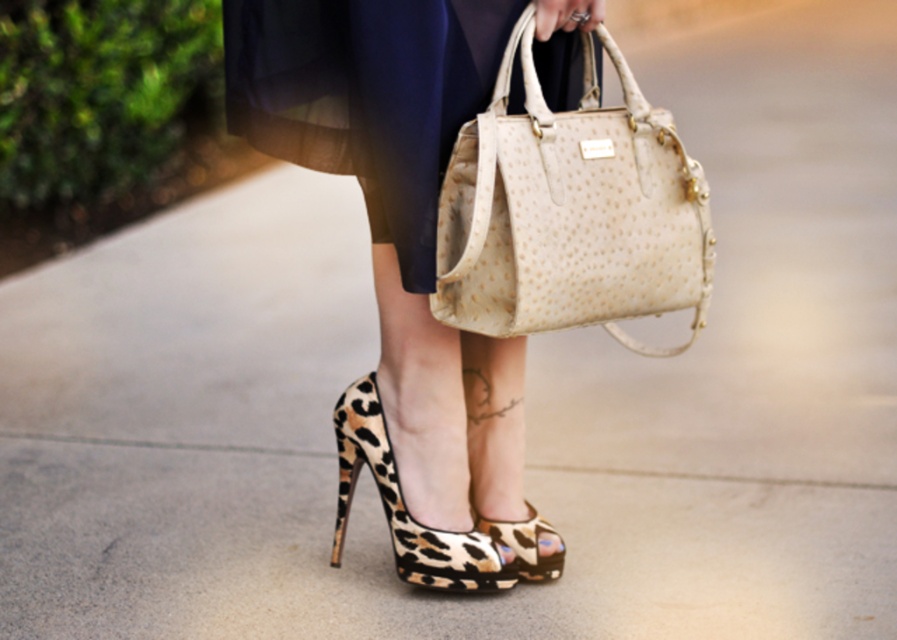
You are standing in front of the person and looking at their handbag. There are two points marked on the image. Which point is closer to you, point (675, 259) or point (442, 20)?

Point (442, 20) is closer to you because it is in front of point (675, 259).